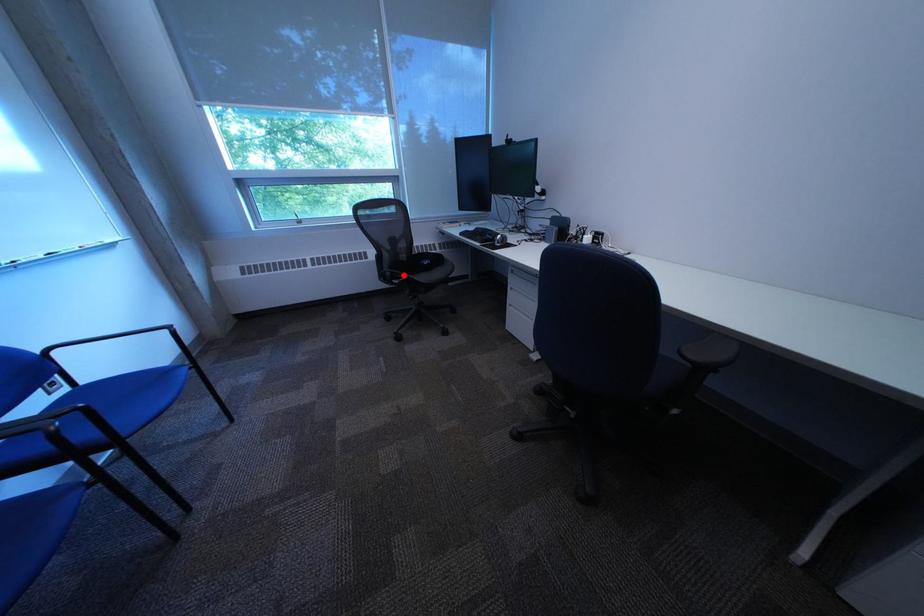
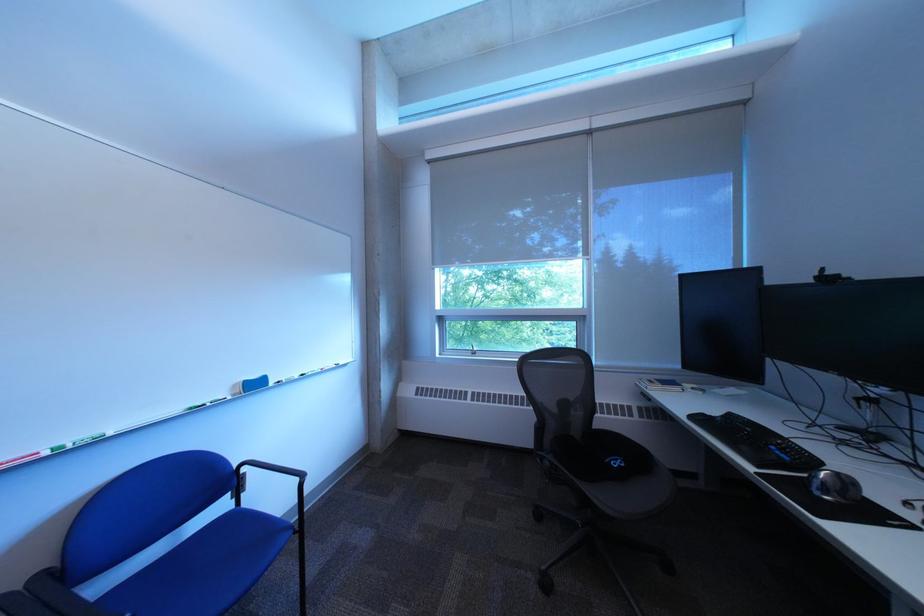
Where in the second image is the point corresponding to the highlighted location from the first image?

(563, 464)